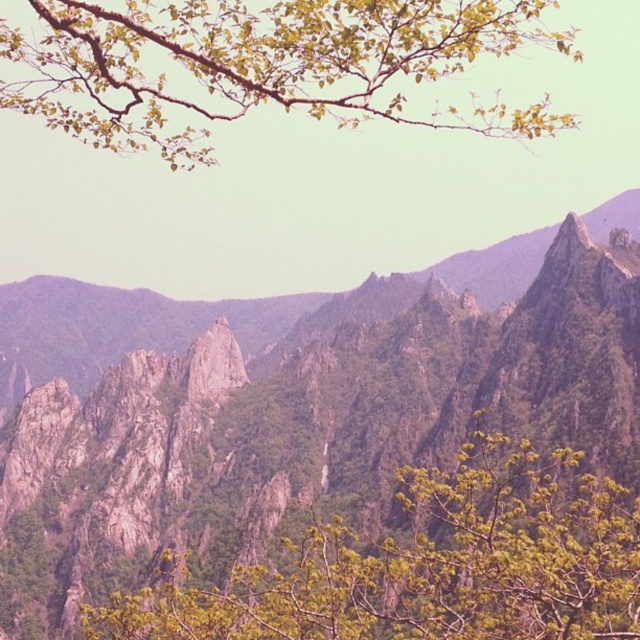
Question: Is rugged stone mountains at center positioned at the back of green leafy tree at center?

Choices:
 (A) yes
 (B) no

Answer: (A)

Question: Which is farther from the green leafy branch at upper center?

Choices:
 (A) rugged stone mountains at center
 (B) green leafy tree at center

Answer: (B)

Question: Which point is farther to the camera?

Choices:
 (A) green leafy tree at center
 (B) green leafy branch at upper center
 (C) rugged stone mountains at center

Answer: (C)

Question: Does green leafy tree at center have a lesser width compared to green leafy branch at upper center?

Choices:
 (A) no
 (B) yes

Answer: (B)

Question: Which of the following is the farthest from the observer?

Choices:
 (A) click(486, 38)
 (B) click(0, 586)
 (C) click(381, 547)

Answer: (A)

Question: In this image, where is rugged stone mountains at center located relative to green leafy tree at center?

Choices:
 (A) left
 (B) right

Answer: (B)